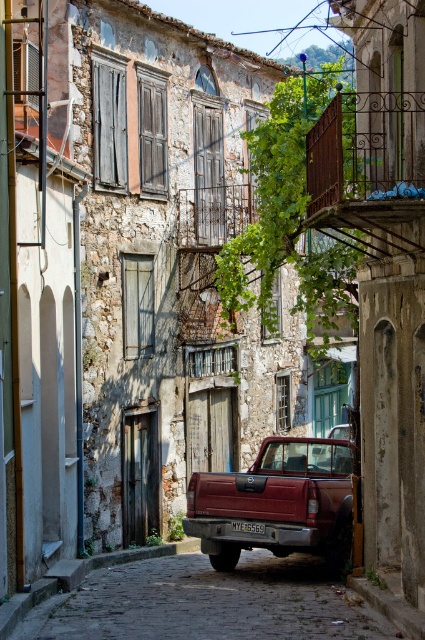
Who is more forward, (159, 577) or (212, 497)?

Point (212, 497) is more forward.

Where is `rustic stone cobblestone street at center`? rustic stone cobblestone street at center is located at coordinates (206, 604).

Can you confirm if matte red truck at center is thinner than black plastic license plate at center?

In fact, matte red truck at center might be wider than black plastic license plate at center.

Which is in front, point (192, 531) or point (232, 529)?

Point (232, 529)

What are the coordinates of `matte red truck at center` in the screenshot? It's located at (277, 502).

Who is taller, rustic stone cobblestone street at center or black plastic license plate at center?

Standing taller between the two is rustic stone cobblestone street at center.

Does rustic stone cobblestone street at center have a greater width compared to black plastic license plate at center?

Indeed, rustic stone cobblestone street at center has a greater width compared to black plastic license plate at center.

Where is `rustic stone cobblestone street at center`? This screenshot has width=425, height=640. rustic stone cobblestone street at center is located at coordinates (206, 604).